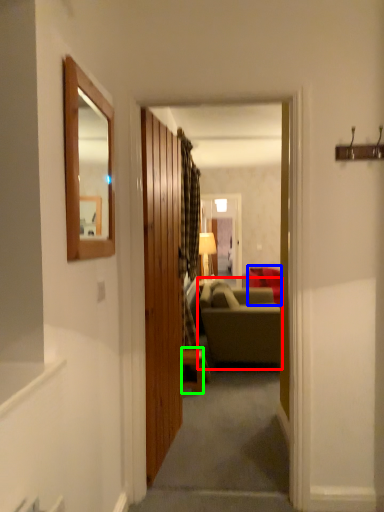
Question: Which object is the closest to the studio couch (highlighted by a red box)? Choose among these: studio couch (highlighted by a blue box) or table (highlighted by a green box).

Choices:
 (A) studio couch
 (B) table

Answer: (B)